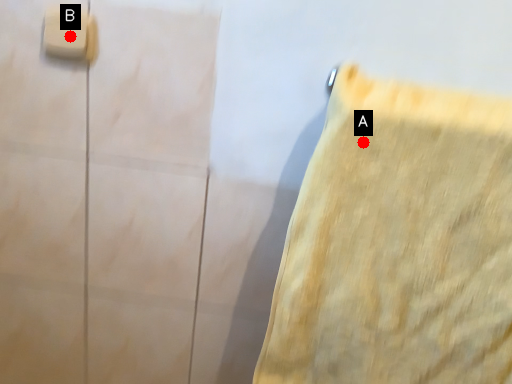
Question: Two points are circled on the image, labeled by A and B beside each circle. Which point appears closest to the camera in this image?

Choices:
 (A) A is closer
 (B) B is closer

Answer: (A)